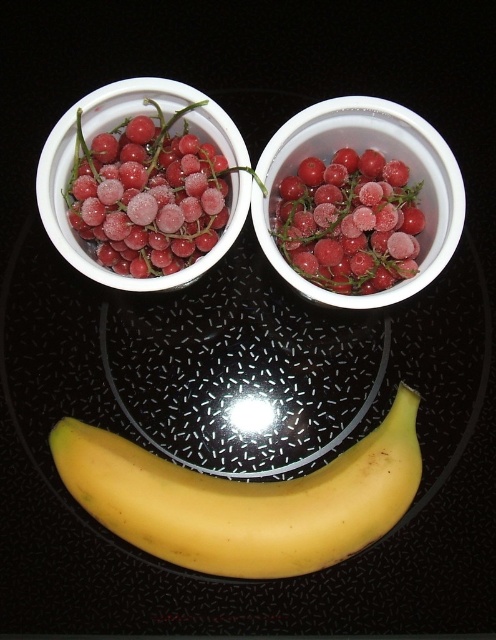
Question: Which object is positioned farthest from the yellow smooth banana at bottom?

Choices:
 (A) frozen red berries at upper center
 (B) frozen red berries at center

Answer: (B)

Question: Is yellow smooth banana at bottom positioned behind frozen red berries at upper center?

Choices:
 (A) no
 (B) yes

Answer: (A)

Question: Does frozen red berries at upper left lie behind frozen red berries at center?

Choices:
 (A) no
 (B) yes

Answer: (B)

Question: Estimate the real-world distances between objects in this image. Which object is farther from the frozen red berries at upper left?

Choices:
 (A) frozen red berries at center
 (B) yellow smooth banana at bottom

Answer: (B)

Question: Estimate the real-world distances between objects in this image. Which object is farther from the frozen red berries at upper center?

Choices:
 (A) frozen red berries at upper left
 (B) frozen red berries at center

Answer: (A)

Question: In this image, where is yellow smooth banana at bottom located relative to frozen red berries at center?

Choices:
 (A) right
 (B) left

Answer: (B)